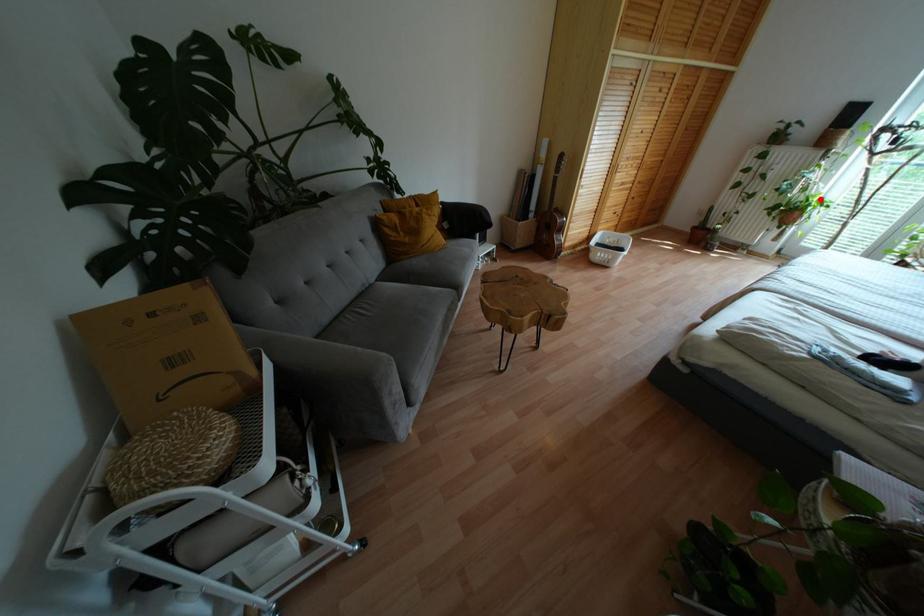
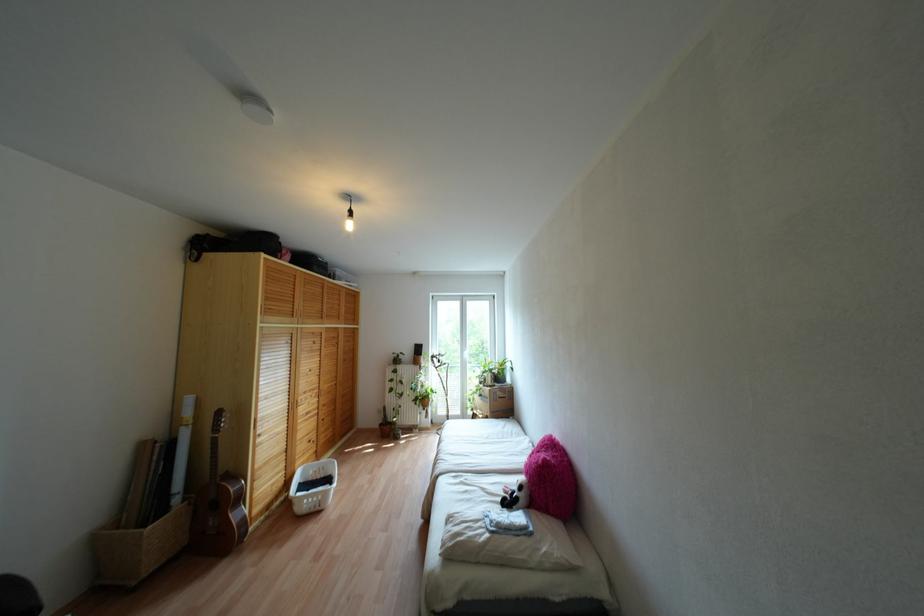
Question: I am providing you with two images of the same scene from different viewpoints. Given a red point in image1, look at the same physical point in image2. Is it:

Choices:
 (A) Closer to the viewpoint
 (B) Farther from the viewpoint

Answer: (B)